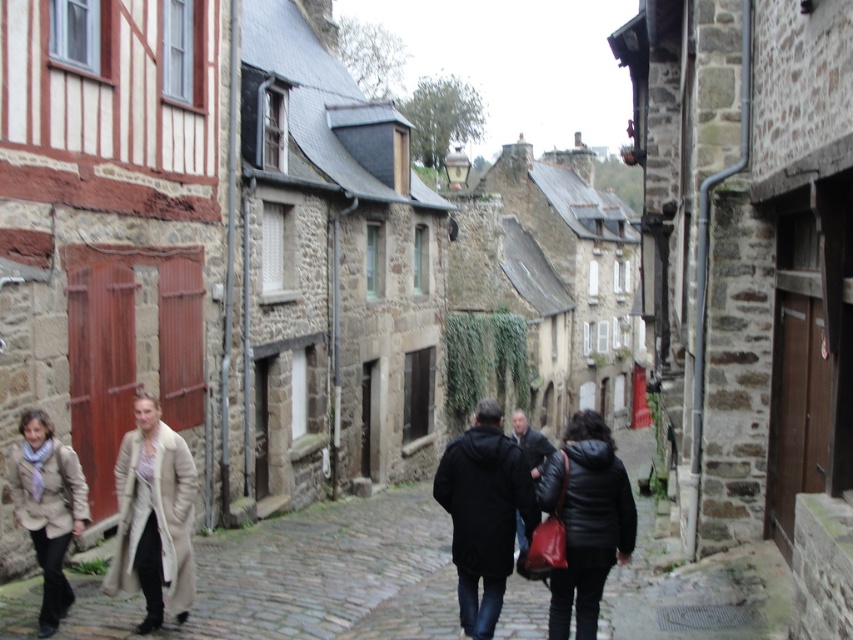
You are a tailor observing two coats in the image. The black matte coat at center and the beige wool coat at center. Which coat is wider?

The black matte coat at center is wider than the beige wool coat at center according to their widths.

You are standing on the cobblestone street and want to take a photo of both the historic stone buildings and the person walking. The buildings are at point (585, 428) and the person is at point (161, 465). Which point should you focus on first to ensure both are in focus?

You should focus on point (585, 428) first because it is closer to the camera than point (161, 465). This ensures the buildings are in focus while the person will still be in the frame but slightly farther away.

You are a tour guide leading a group along the cobblestone street. You notice a tourist wearing a black matte coat at center and a local in a blue scarf standing near the red doors on the left. How far apart are these two individuals?

The tourist wearing the black matte coat at center and the local in a blue scarf near the red doors on the left are 7.79 meters apart.